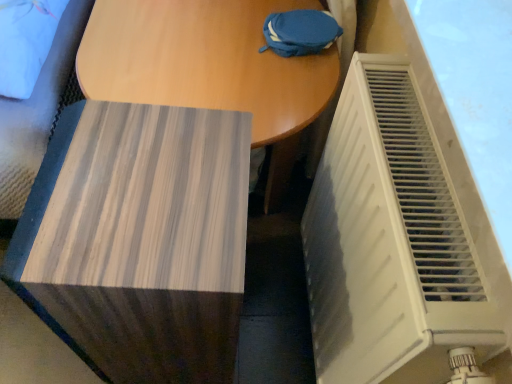
Describe the element at coordinates (390, 242) in the screenshot. I see `white plastic radiator at right` at that location.

Locate an element on the screen. wooden side table at lower left is located at coordinates (140, 239).

Where is `white plastic radiator at right`? The height and width of the screenshot is (384, 512). white plastic radiator at right is located at coordinates (390, 242).

Are white plastic radiator at right and wooden side table at lower left located far from each other?

white plastic radiator at right is actually quite close to wooden side table at lower left.

Which point is more forward, (x=465, y=336) or (x=165, y=322)?

The point (x=465, y=336) is closer to the camera.

How different are the orientations of white plastic radiator at right and wooden side table at lower left in degrees?

1.75 degrees separate the facing orientations of white plastic radiator at right and wooden side table at lower left.

Considering the relative sizes of white plastic radiator at right and wooden side table at lower left in the image provided, is white plastic radiator at right smaller than wooden side table at lower left?

Yes.

Would you say white plastic radiator at right is inside or outside wooden table at center?

The correct answer is: outside.

Considering the relative sizes of white plastic radiator at right and wooden table at center in the image provided, is white plastic radiator at right thinner than wooden table at center?

Indeed, white plastic radiator at right has a lesser width compared to wooden table at center.

Does point (464, 230) come farther from viewer compared to point (157, 24)?

That is False.

This screenshot has height=384, width=512. I want to click on table above the white plastic radiator at right (from the image's perspective), so click(209, 68).

Which point is more forward, [109,42] or [34,254]?

Positioned in front is point [34,254].

This screenshot has width=512, height=384. Find the location of `furniture located on the left of wooden table at center`. furniture located on the left of wooden table at center is located at coordinates (140, 239).

Who is bigger, wooden table at center or wooden side table at lower left?

wooden table at center.

Considering the relative positions of wooden side table at lower left and wooden table at center in the image provided, is wooden side table at lower left to the left of wooden table at center from the viewer's perspective?

Yes.

Does wooden side table at lower left have a greater width compared to wooden table at center?

No, wooden side table at lower left is not wider than wooden table at center.

From a real-world perspective, which object stands above the other?

In real-world perspective, wooden side table at lower left is above.

Consider the image. Is wooden side table at lower left positioned with its back to white plastic radiator at right?

Yes, wooden side table at lower left is facing away from white plastic radiator at right.

Considering the sizes of objects wooden side table at lower left and white plastic radiator at right in the image provided, who is smaller, wooden side table at lower left or white plastic radiator at right?

Smaller between the two is white plastic radiator at right.

Between wooden side table at lower left and white plastic radiator at right, which one has more height?

wooden side table at lower left is taller.

Is wooden side table at lower left to the left or to the right of white plastic radiator at right in the image?

Clearly, wooden side table at lower left is on the left of white plastic radiator at right in the image.

Is wooden table at center oriented towards white plastic radiator at right?

No, wooden table at center is not turned towards white plastic radiator at right.

Find the location of a particular element. Image resolution: width=512 pixels, height=384 pixels. table that appears above the white plastic radiator at right (from the image's perspective) is located at coordinates (209, 68).

From a real-world perspective, is wooden table at center positioned above or below white plastic radiator at right?

In terms of real-world spatial position, wooden table at center is below white plastic radiator at right.

From the image's perspective, is wooden table at center above or below white plastic radiator at right?

From the image's perspective, wooden table at center appears above white plastic radiator at right.

Find the location of `air conditioning lying on the right of wooden side table at lower left`. air conditioning lying on the right of wooden side table at lower left is located at coordinates (390, 242).

Image resolution: width=512 pixels, height=384 pixels. Identify the location of air conditioning above the wooden table at center (from a real-world perspective). (390, 242).

When comparing their distances from wooden table at center, does white plastic radiator at right or wooden side table at lower left seem further?

Among the two, white plastic radiator at right is located further to wooden table at center.

Based on their spatial positions, is wooden table at center or white plastic radiator at right closer to wooden side table at lower left?

white plastic radiator at right is closer to wooden side table at lower left.

Estimate the real-world distances between objects in this image. Which object is further from white plastic radiator at right, wooden table at center or wooden side table at lower left?

wooden table at center is further to white plastic radiator at right.

Based on their spatial positions, is wooden side table at lower left or wooden table at center closer to white plastic radiator at right?

wooden side table at lower left.

Based on their spatial positions, is white plastic radiator at right or wooden table at center closer to wooden side table at lower left?

Based on the image, white plastic radiator at right appears to be nearer to wooden side table at lower left.

Based on their spatial positions, is wooden side table at lower left or white plastic radiator at right closer to wooden table at center?

The object closer to wooden table at center is wooden side table at lower left.

This screenshot has height=384, width=512. In order to click on air conditioning between wooden table at center and wooden side table at lower left vertically in this screenshot , I will do `click(390, 242)`.